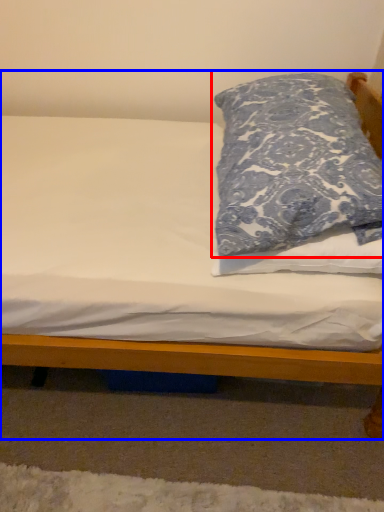
Question: Which point is closer to the camera, pillow (highlighted by a red box) or bed (highlighted by a blue box)?

Choices:
 (A) pillow
 (B) bed

Answer: (A)